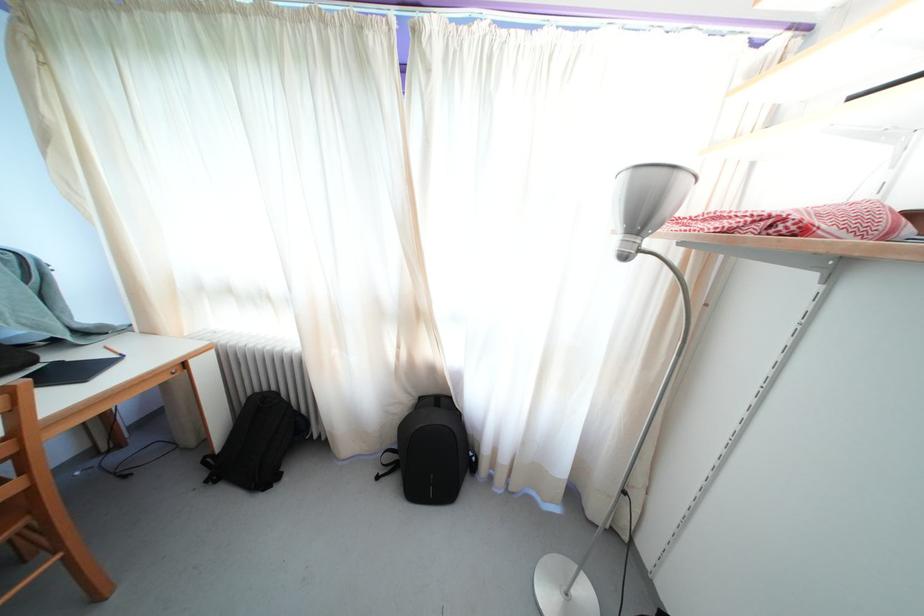
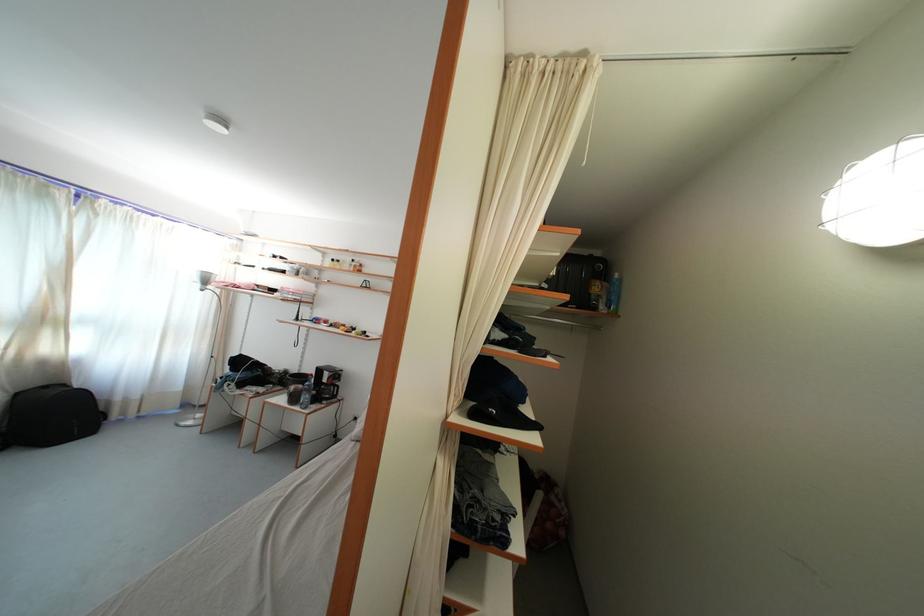
The point at (427,405) is marked in the first image. Where is the corresponding point in the second image?

(23, 400)